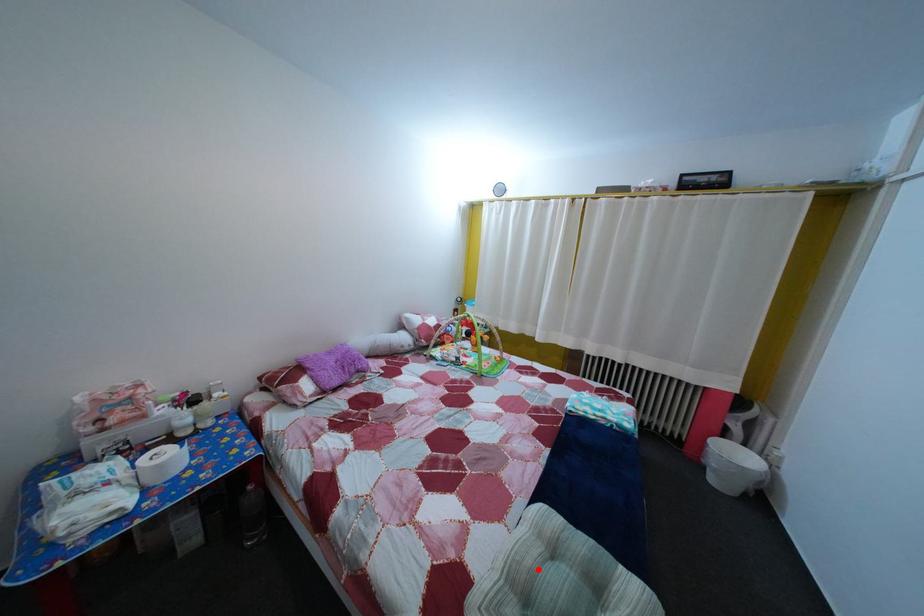
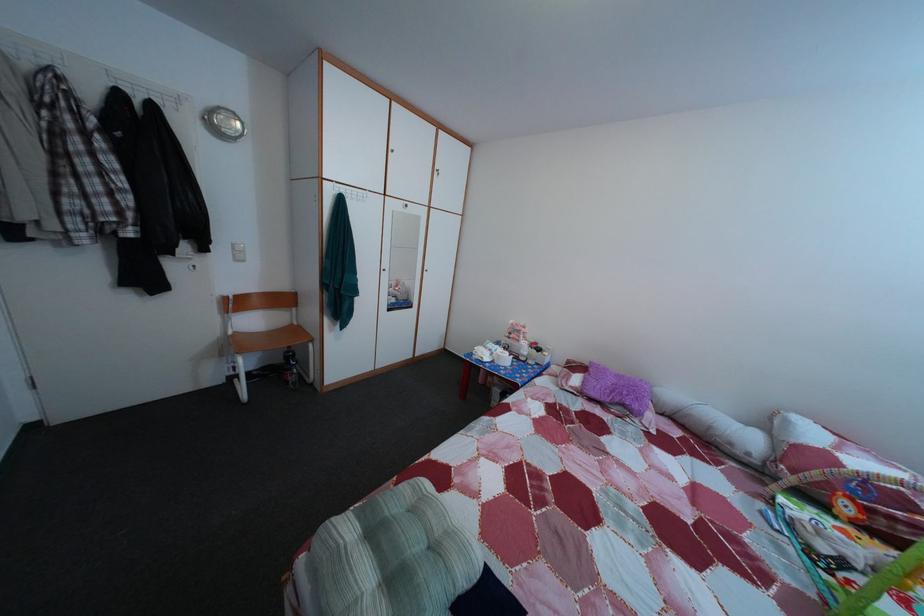
Find the pixel in the second image that matches the highlighted location in the first image.

(440, 521)